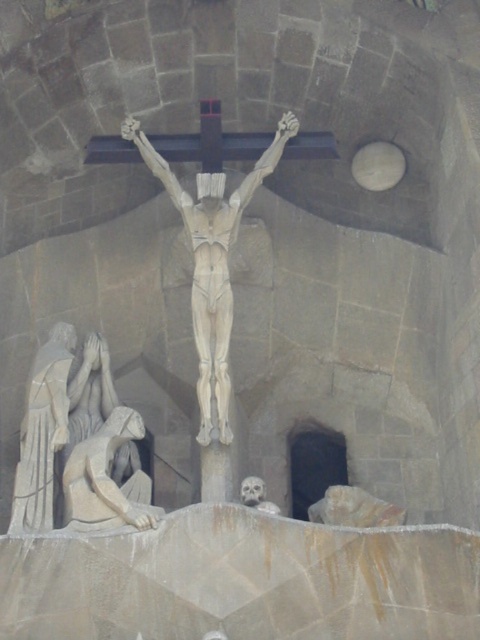
You are an art conservator examining the stone architectural structure. You need to determine which object is bigger between the smooth stone statue at lower left and the smooth gray skull at lower center. Based on the scene, which one is larger?

The smooth stone statue at lower left is larger than the smooth gray skull at lower center.

Consider the image. You are an art conservator assessing the stone carvings in the cathedral. You need to determine which object has a greater width for a restoration report. Which is wider between the smooth stone crucifix at center and the smooth gray skull at lower center?

The smooth stone crucifix at center is wider than the smooth gray skull at lower center according to the description.